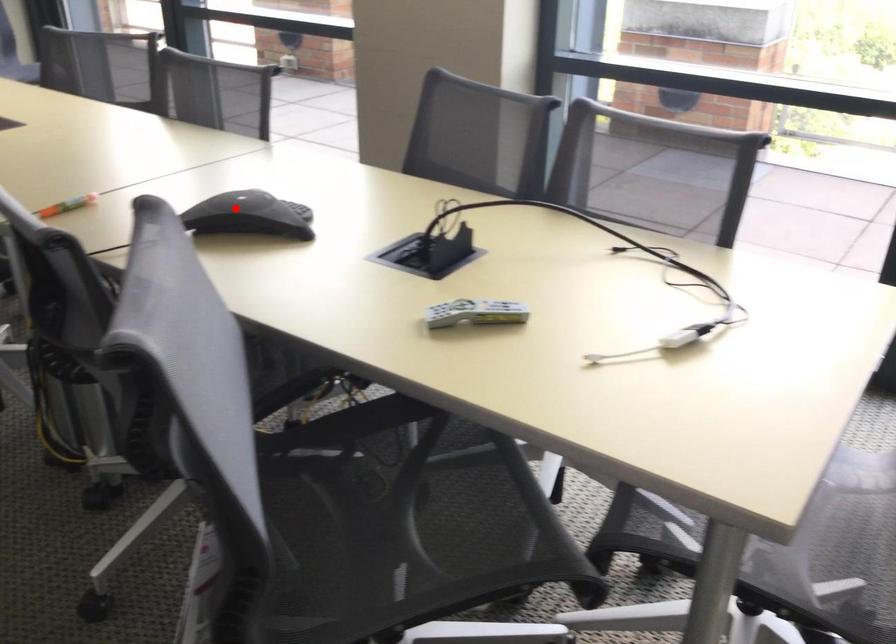
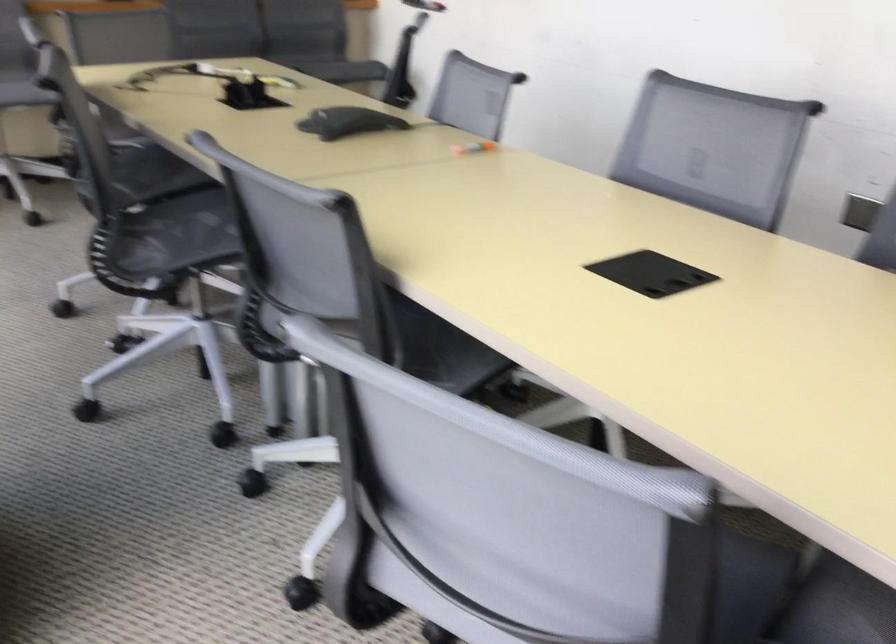
Question: I am providing you with two images of the same scene from different viewpoints. Given a red point in image1, look at the same physical point in image2. Is it:

Choices:
 (A) Closer to the viewpoint
 (B) Farther from the viewpoint

Answer: (B)